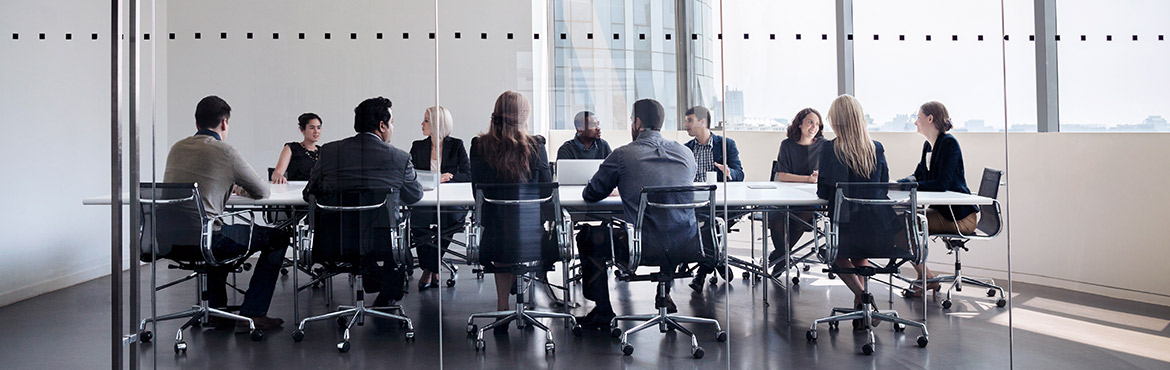
Where is `metal brace on back of chair`? The image size is (1170, 370). metal brace on back of chair is located at coordinates (160, 200), (343, 209), (535, 196), (684, 206), (1000, 183).